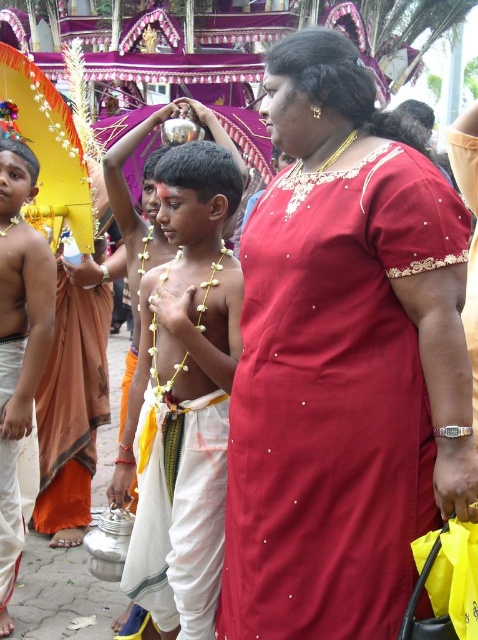
Question: Is pearl necklace at center behind white cotton dhoti at center?

Choices:
 (A) no
 (B) yes

Answer: (B)

Question: Can you confirm if matte red dress at center is positioned below orange silk sari at left?

Choices:
 (A) yes
 (B) no

Answer: (B)

Question: Which object is closer to the camera taking this photo?

Choices:
 (A) white cotton robe at lower left
 (B) white cloth boy at center

Answer: (B)

Question: Estimate the real-world distances between objects in this image. Which object is closer to the white cotton robe at lower left?

Choices:
 (A) orange silk sari at left
 (B) pearl necklace at center

Answer: (A)

Question: Is matte red dress at center positioned behind pearl necklace at center?

Choices:
 (A) yes
 (B) no

Answer: (B)

Question: Which object appears closest to the camera in this image?

Choices:
 (A) white cotton dhoti at center
 (B) matte red dress at center
 (C) orange silk sari at left

Answer: (B)